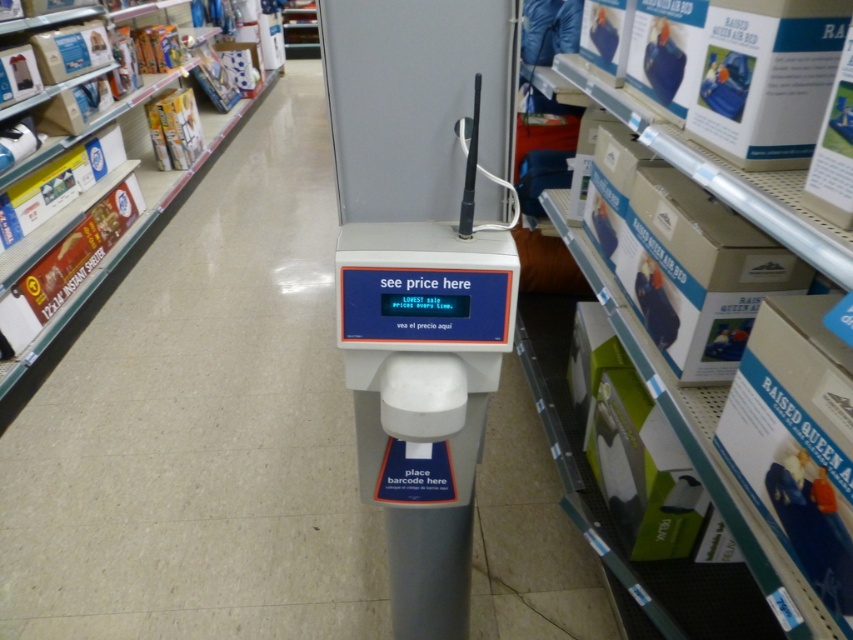
You are a customer in a store and need to weigh your groceries. You see a white plastic scale at center and white cardboard boxes at left. Which object should you use to weigh your groceries?

The white plastic scale at center is the correct tool for weighing groceries, as it is a scale designed for that purpose, while the white cardboard boxes at left are likely for packaging or storage.

You are a customer in the store and need to weigh your bag. You see the white plastic scale at center and the white cardboard boxes at left. Which object should you use to weigh your bag?

The white plastic scale at center should be used to weigh your bag because it is a scale, while the white cardboard boxes at left are for storage or packaging and not designed for weighing.

You are a customer holding a 12 inch long item and want to place it on the white plastic scale at center. Can the item fit on the scale?

The white plastic scale at center is 30.20 inches away from the camera. The distance does not indicate the scale size, so we cannot determine if the item will fit based on the given information.